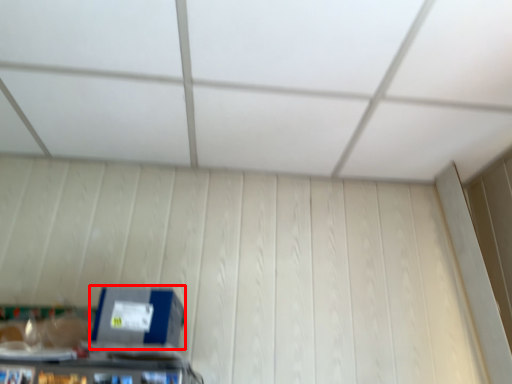
Question: From the image's perspective, considering the relative positions of box (annotated by the red box) and exhaust hood in the image provided, where is box (annotated by the red box) located with respect to the staircase?

Choices:
 (A) below
 (B) above

Answer: (A)